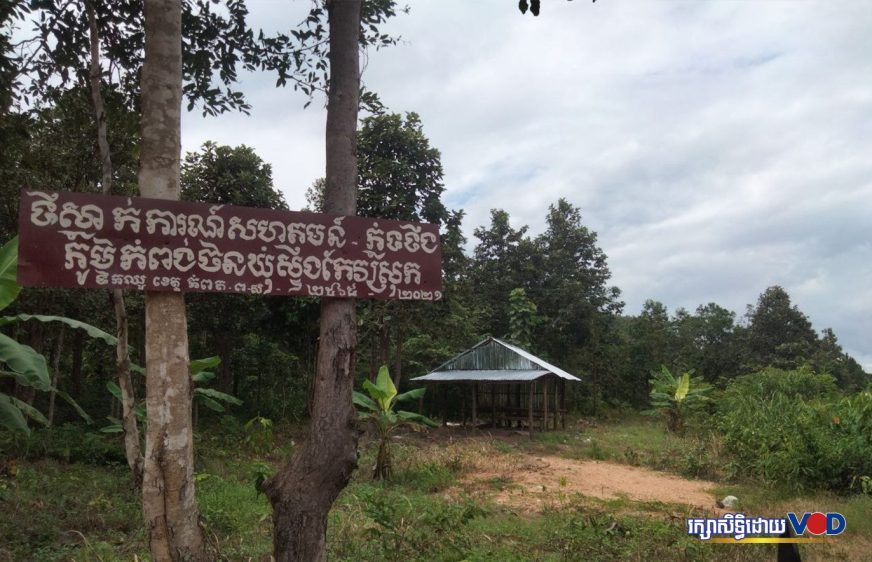
Find the location of `burgundy rectangular wooden sign`. burgundy rectangular wooden sign is located at coordinates (26, 198).